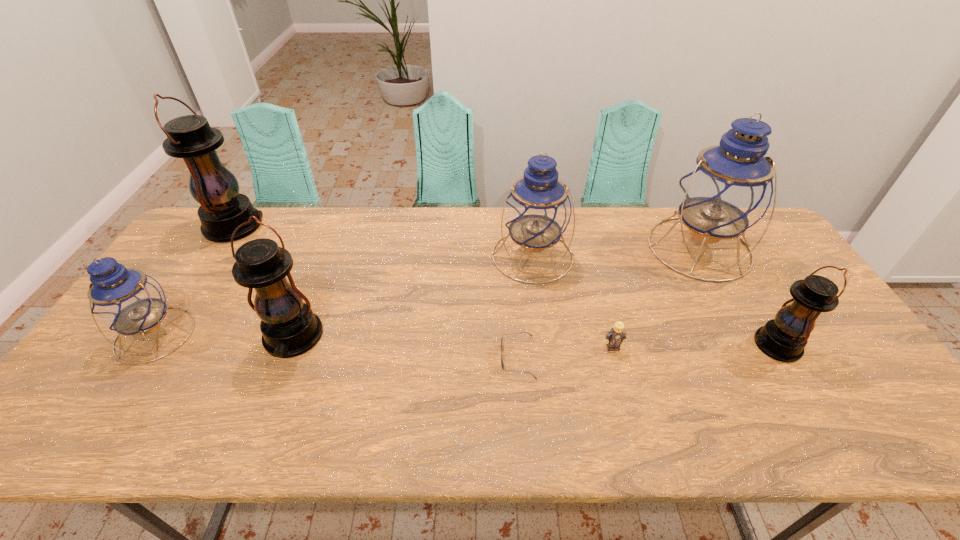
The height and width of the screenshot is (540, 960). I want to click on vacant area that satisfies the following two spatial constraints: 1. on the front-facing side of the third lantern from right to left; 2. on the lenses of the sunglasses, so click(545, 357).